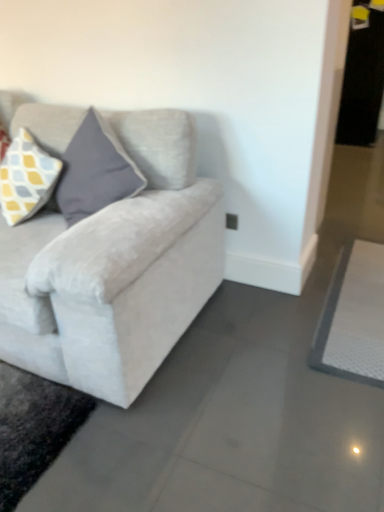
In order to click on white textured yoga mat at lower right in this screenshot , I will do `click(353, 317)`.

Identify the location of velvet light gray couch at left. This screenshot has height=512, width=384. (116, 269).

Locate an element on the screen. This screenshot has width=384, height=512. white textured yoga mat at lower right is located at coordinates (x=353, y=317).

Is velvet light gray couch at left taller than white textured yoga mat at lower right?

Indeed, velvet light gray couch at left has a greater height compared to white textured yoga mat at lower right.

From a real-world perspective, which object stands above the other?

velvet light gray couch at left, from a real-world perspective.

Consider the image. Which point is more distant from viewer, (139, 130) or (363, 357)?

The point (139, 130) is farther from the camera.

Is yellow and gray checkered fabric pillow at upper left positioned before white textured yoga mat at lower right?

No, it is behind white textured yoga mat at lower right.

Image resolution: width=384 pixels, height=512 pixels. I want to click on pillow behind the white textured yoga mat at lower right, so [x=26, y=178].

Can you confirm if yellow and gray checkered fabric pillow at upper left is shorter than white textured yoga mat at lower right?

No, yellow and gray checkered fabric pillow at upper left is not shorter than white textured yoga mat at lower right.

Can you tell me how much yellow and gray checkered fabric pillow at upper left and white textured yoga mat at lower right differ in facing direction?

There is a 0.198-degree angle between the facing directions of yellow and gray checkered fabric pillow at upper left and white textured yoga mat at lower right.

Where is `studio couch above the white textured yoga mat at lower right (from a real-world perspective)`? Image resolution: width=384 pixels, height=512 pixels. studio couch above the white textured yoga mat at lower right (from a real-world perspective) is located at coordinates (116, 269).

Can you confirm if white textured yoga mat at lower right is shorter than velvet light gray couch at left?

Indeed, white textured yoga mat at lower right has a lesser height compared to velvet light gray couch at left.

Does point (353, 286) lie behind point (206, 279)?

Yes, it is behind point (206, 279).

Is yellow and gray checkered fabric pillow at upper left not within velvet light gray couch at left?

That's incorrect, yellow and gray checkered fabric pillow at upper left is not completely outside velvet light gray couch at left.

Is yellow and gray checkered fabric pillow at upper left not near velvet light gray couch at left?

No, there isn't a large distance between yellow and gray checkered fabric pillow at upper left and velvet light gray couch at left.

From the picture: Between yellow and gray checkered fabric pillow at upper left and velvet light gray couch at left, which one has larger size?

velvet light gray couch at left.

The image size is (384, 512). Identify the location of pillow positioned vertically above the velvet light gray couch at left (from a real-world perspective). (26, 178).

Between velvet light gray couch at left and yellow and gray checkered fabric pillow at upper left, which one has larger size?

velvet light gray couch at left is bigger.

Choose the correct answer: Is velvet light gray couch at left inside yellow and gray checkered fabric pillow at upper left or outside it?

velvet light gray couch at left is not inside yellow and gray checkered fabric pillow at upper left, it's outside.

From the image's perspective, which object appears higher, velvet light gray couch at left or yellow and gray checkered fabric pillow at upper left?

yellow and gray checkered fabric pillow at upper left, from the image's perspective.

Does point (55, 318) come farther from viewer compared to point (23, 184)?

That is False.

From a real-world perspective, is white textured yoga mat at lower right beneath yellow and gray checkered fabric pillow at upper left?

Indeed, from a real-world perspective, white textured yoga mat at lower right is positioned beneath yellow and gray checkered fabric pillow at upper left.

Considering the sizes of objects white textured yoga mat at lower right and yellow and gray checkered fabric pillow at upper left in the image provided, who is shorter, white textured yoga mat at lower right or yellow and gray checkered fabric pillow at upper left?

white textured yoga mat at lower right is shorter.

Is white textured yoga mat at lower right completely or partially outside of yellow and gray checkered fabric pillow at upper left?

Yes, white textured yoga mat at lower right is not within yellow and gray checkered fabric pillow at upper left.

Does white textured yoga mat at lower right come behind yellow and gray checkered fabric pillow at upper left?

That is False.

Find the location of a particular element. yoga mat below the velvet light gray couch at left (from the image's perspective) is located at coordinates (353, 317).

Find the location of a particular element. pillow located above the white textured yoga mat at lower right (from the image's perspective) is located at coordinates (26, 178).

Based on their spatial positions, is white textured yoga mat at lower right or yellow and gray checkered fabric pillow at upper left closer to velvet light gray couch at left?

yellow and gray checkered fabric pillow at upper left.

Estimate the real-world distances between objects in this image. Which object is closer to white textured yoga mat at lower right, yellow and gray checkered fabric pillow at upper left or velvet light gray couch at left?

velvet light gray couch at left.

Estimate the real-world distances between objects in this image. Which object is further from white textured yoga mat at lower right, velvet light gray couch at left or yellow and gray checkered fabric pillow at upper left?

Based on the image, yellow and gray checkered fabric pillow at upper left appears to be further to white textured yoga mat at lower right.

When comparing their distances from yellow and gray checkered fabric pillow at upper left, does white textured yoga mat at lower right or velvet light gray couch at left seem further?

white textured yoga mat at lower right.

When comparing their distances from yellow and gray checkered fabric pillow at upper left, does velvet light gray couch at left or white textured yoga mat at lower right seem closer?

Among the two, velvet light gray couch at left is located nearer to yellow and gray checkered fabric pillow at upper left.

When comparing their distances from velvet light gray couch at left, does yellow and gray checkered fabric pillow at upper left or white textured yoga mat at lower right seem further?

white textured yoga mat at lower right is positioned further to the anchor velvet light gray couch at left.

Locate an element on the screen. The width and height of the screenshot is (384, 512). pillow situated between velvet light gray couch at left and white textured yoga mat at lower right from left to right is located at coordinates (26, 178).